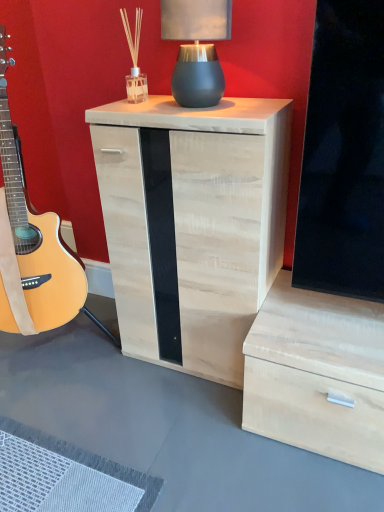
In the scene shown: In order to face matte gray ceramic table lamp at upper center, should I rotate leftwards or rightwards?

A 0.578 degree turn to the right will do.

Identify the location of matte gray ceramic table lamp at upper center. (197, 48).

Considering the sizes of objects light wood/texture nightstand at center and matte gray ceramic table lamp at upper center in the image provided, who is shorter, light wood/texture nightstand at center or matte gray ceramic table lamp at upper center?

Standing shorter between the two is matte gray ceramic table lamp at upper center.

From the image's perspective, would you say light wood/texture nightstand at center is positioned over matte gray ceramic table lamp at upper center?

Actually, light wood/texture nightstand at center appears below matte gray ceramic table lamp at upper center in the image.

Is light wood/texture nightstand at center far away from matte gray ceramic table lamp at upper center?

light wood/texture nightstand at center is near matte gray ceramic table lamp at upper center, not far away.

From a real-world perspective, is light wood/texture nightstand at center physically below matte gray ceramic table lamp at upper center?

Yes, from a real-world perspective, light wood/texture nightstand at center is under matte gray ceramic table lamp at upper center.

At what (x,y) coordinates should I click in order to perform the action: click on nightstand on the left of matte gray ceramic table lamp at upper center. Please return your answer as a coordinate pair (x, y). Looking at the image, I should click on pos(192,224).

Considering the relative sizes of matte gray ceramic table lamp at upper center and light wood/texture nightstand at center in the image provided, is matte gray ceramic table lamp at upper center thinner than light wood/texture nightstand at center?

Indeed, matte gray ceramic table lamp at upper center has a lesser width compared to light wood/texture nightstand at center.

In the scene shown: Is matte gray ceramic table lamp at upper center at the right side of light wood/texture nightstand at center?

Yes, matte gray ceramic table lamp at upper center is to the right of light wood/texture nightstand at center.

From the picture: Is matte gray ceramic table lamp at upper center not within light wood/texture nightstand at center?

Yes, matte gray ceramic table lamp at upper center is located beyond the bounds of light wood/texture nightstand at center.

Is natural wood guitar at left oriented away from matte gray ceramic table lamp at upper center?

natural wood guitar at left is not turned away from matte gray ceramic table lamp at upper center.

Is natural wood guitar at left beside matte gray ceramic table lamp at upper center?

natural wood guitar at left is not next to matte gray ceramic table lamp at upper center, and they're not touching.

How many degrees apart are the facing directions of natural wood guitar at left and matte gray ceramic table lamp at upper center?

The facing directions of natural wood guitar at left and matte gray ceramic table lamp at upper center are 2.68 degrees apart.

Considering the sizes of objects natural wood guitar at left and matte gray ceramic table lamp at upper center in the image provided, who is taller, natural wood guitar at left or matte gray ceramic table lamp at upper center?

natural wood guitar at left is taller.

From the image's perspective, is natural wood guitar at left located above or below light wood/texture nightstand at center?

natural wood guitar at left is above light wood/texture nightstand at center.

Based on the photo, which point is more forward, (74, 271) or (247, 281)?

Positioned in front is point (247, 281).

Which is more to the right, natural wood guitar at left or light wood/texture nightstand at center?

light wood/texture nightstand at center is more to the right.

Is the position of natural wood guitar at left more distant than that of light wood/texture nightstand at center?

No, it is in front of light wood/texture nightstand at center.

Considering the sizes of objects matte gray ceramic table lamp at upper center and natural wood guitar at left in the image provided, who is thinner, matte gray ceramic table lamp at upper center or natural wood guitar at left?

With smaller width is matte gray ceramic table lamp at upper center.

From a real-world perspective, between matte gray ceramic table lamp at upper center and natural wood guitar at left, who is vertically lower?

From a 3D spatial view, natural wood guitar at left is below.

Considering their positions, is matte gray ceramic table lamp at upper center located in front of or behind natural wood guitar at left?

matte gray ceramic table lamp at upper center is positioned farther from the viewer than natural wood guitar at left.

Does matte gray ceramic table lamp at upper center touch natural wood guitar at left?

They are not placed beside each other.

Which of these two, light wood/texture nightstand at center or natural wood guitar at left, is wider?

Wider between the two is natural wood guitar at left.

Which object is closer to the camera taking this photo, light wood/texture nightstand at center or natural wood guitar at left?

natural wood guitar at left is in front.

Considering the positions of point (158, 282) and point (61, 268), is point (158, 282) closer or farther from the camera than point (61, 268)?

Point (158, 282) is positioned closer to the camera compared to point (61, 268).

Considering the relative sizes of light wood/texture nightstand at center and natural wood guitar at left in the image provided, is light wood/texture nightstand at center taller than natural wood guitar at left?

No, light wood/texture nightstand at center is not taller than natural wood guitar at left.

Find the location of a particular element. nightstand that is below the matte gray ceramic table lamp at upper center (from the image's perspective) is located at coordinates (192, 224).

Where is `nightstand on the left of the matte gray ceramic table lamp at upper center`? nightstand on the left of the matte gray ceramic table lamp at upper center is located at coordinates (192, 224).

When comparing their distances from matte gray ceramic table lamp at upper center, does light wood/texture nightstand at center or natural wood guitar at left seem further?

natural wood guitar at left is positioned further to the anchor matte gray ceramic table lamp at upper center.

From the picture: Based on their spatial positions, is natural wood guitar at left or light wood/texture nightstand at center closer to matte gray ceramic table lamp at upper center?

Among the two, light wood/texture nightstand at center is located nearer to matte gray ceramic table lamp at upper center.

Based on their spatial positions, is light wood/texture nightstand at center or matte gray ceramic table lamp at upper center closer to natural wood guitar at left?

The object closer to natural wood guitar at left is light wood/texture nightstand at center.

When comparing their distances from natural wood guitar at left, does matte gray ceramic table lamp at upper center or light wood/texture nightstand at center seem closer?

light wood/texture nightstand at center is positioned closer to the anchor natural wood guitar at left.

When comparing their distances from light wood/texture nightstand at center, does natural wood guitar at left or matte gray ceramic table lamp at upper center seem closer?

matte gray ceramic table lamp at upper center is closer to light wood/texture nightstand at center.

Which object lies nearer to the anchor point light wood/texture nightstand at center, matte gray ceramic table lamp at upper center or natural wood guitar at left?

matte gray ceramic table lamp at upper center is positioned closer to the anchor light wood/texture nightstand at center.

This screenshot has width=384, height=512. Identify the location of nightstand between natural wood guitar at left and matte gray ceramic table lamp at upper center from left to right. (192, 224).